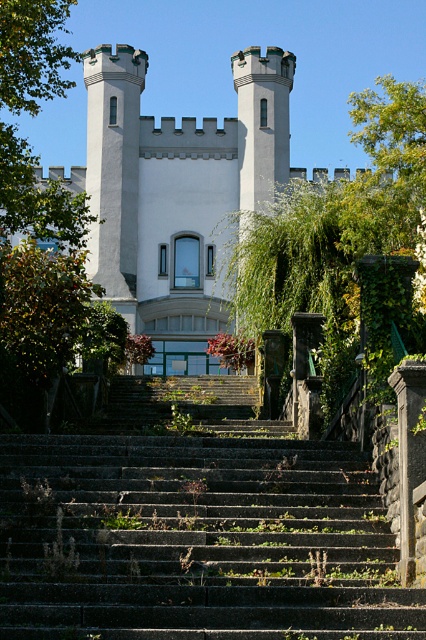
You are standing in front of a grand building and want to take a photo of the white stone castle at center. Based on its position, where should you stand to capture it in the frame?

To capture the white stone castle at center in the frame, you should position yourself in front of it, as it is located at point (175, 188).

In the scene shown: You are standing in front of the castle structure and want to take a photo. You notice two points marked on the image at coordinates point (184, 332) and point (281, 292). Which point is closer to your camera position?

Point (184, 332) is further to the camera than point (281, 292), so the point closer to the camera is point (281, 292).